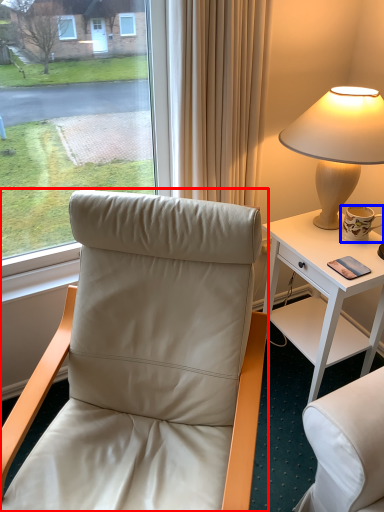
Question: Which object is closer to the camera taking this photo, chair (highlighted by a red box) or coffee cup (highlighted by a blue box)?

Choices:
 (A) chair
 (B) coffee cup

Answer: (A)